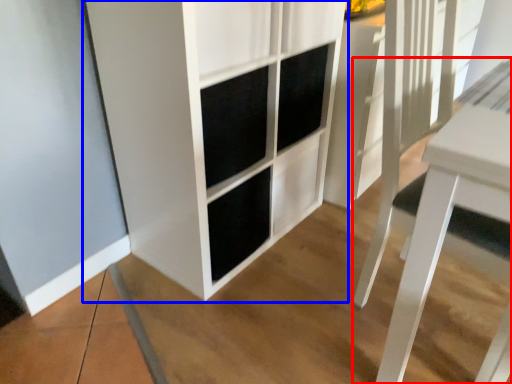
Question: Which of the following is the closest to the observer, table (highlighted by a red box) or cupboard (highlighted by a blue box)?

Choices:
 (A) table
 (B) cupboard

Answer: (A)